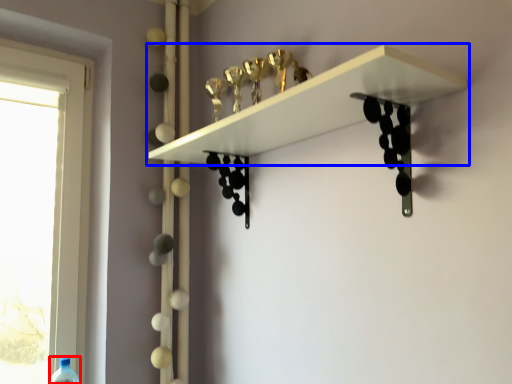
Question: Among these objects, which one is farthest to the camera, wine bottle (highlighted by a red box) or shelf (highlighted by a blue box)?

Choices:
 (A) wine bottle
 (B) shelf

Answer: (A)